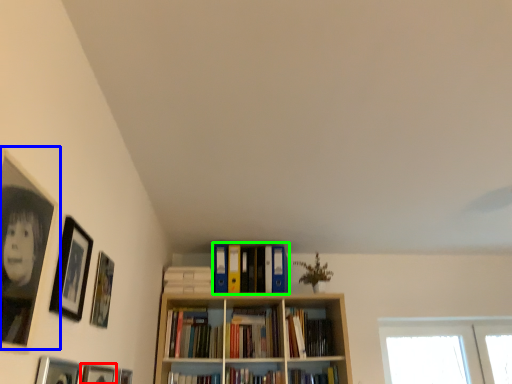
Question: Considering the real-world distances, which object is farthest from picture frame (highlighted by a red box)? picture frame (highlighted by a blue box) or book (highlighted by a green box)?

Choices:
 (A) picture frame
 (B) book

Answer: (B)